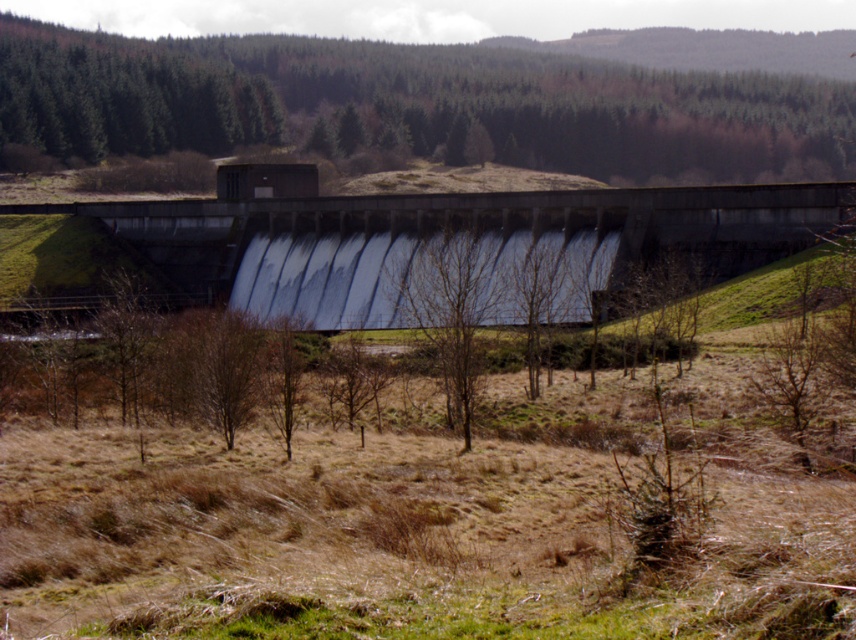
You are standing at the center of the image and want to walk towards the dam. Which direction should you move relative to the bare wood tree at center?

Since the dam is positioned across the middle of the frame and the bare wood tree at center is located at coordinates approximately center, you should move away from the tree towards the dam. However, the exact direction depends on the tree position. The tree is at point (450,310), which is slightly to the right and above the true center. Therefore, moving towards the dam would mean moving slightly to the left and below the bare wood tree at center.

You are standing at the base of the dam and want to reach a specific point marked at coordinates point (99, 125). Given that you can walk 100 feet per minute, how many minutes will it take you to reach that point?

The distance of point (99, 125) from viewer is 655.27 feet. At a walking speed of 100 feet per minute, it will take approximately 6.55 minutes to reach the point.